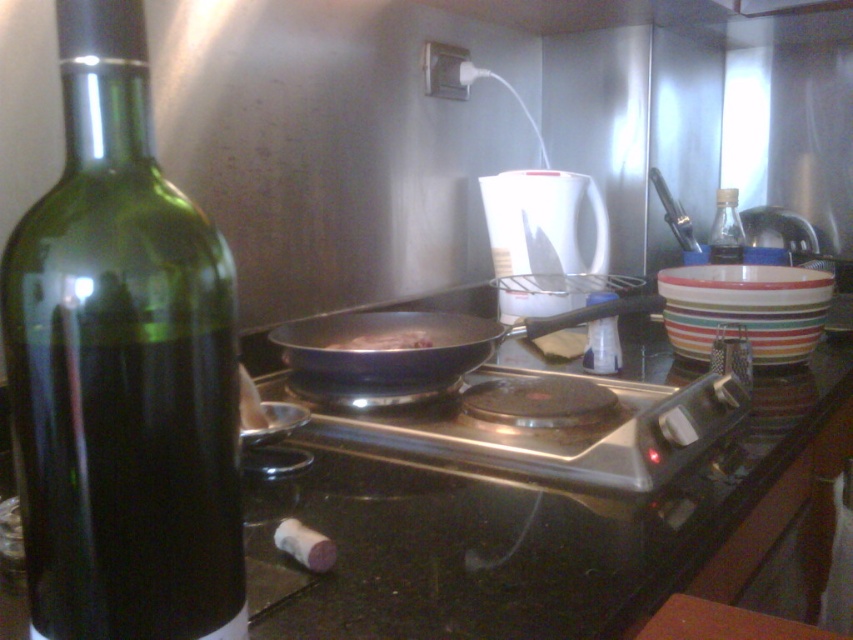
Question: Among these objects, which one is nearest to the camera?

Choices:
 (A) shiny black frying pan at center
 (B) brown matte pan at center

Answer: (A)

Question: From the image, what is the correct spatial relationship of shiny black frying pan at center in relation to clear plastic bottle at center?

Choices:
 (A) right
 (B) left

Answer: (B)

Question: Considering the relative positions of black glossy countertop at center and shiny black frying pan at center in the image provided, where is black glossy countertop at center located with respect to shiny black frying pan at center?

Choices:
 (A) below
 (B) above

Answer: (A)

Question: Which point is farther from the camera taking this photo?

Choices:
 (A) (589, 330)
 (B) (236, 365)
 (C) (555, 321)
 (D) (392, 502)

Answer: (A)

Question: Does shiny black frying pan at center appear over transparent glass bottle at upper right?

Choices:
 (A) yes
 (B) no

Answer: (B)

Question: Which point is farther to the camera?

Choices:
 (A) satin silver pan at center
 (B) transparent glass bottle at upper right
 (C) black glossy countertop at center

Answer: (B)